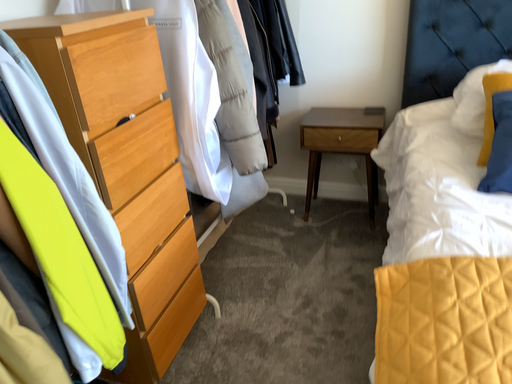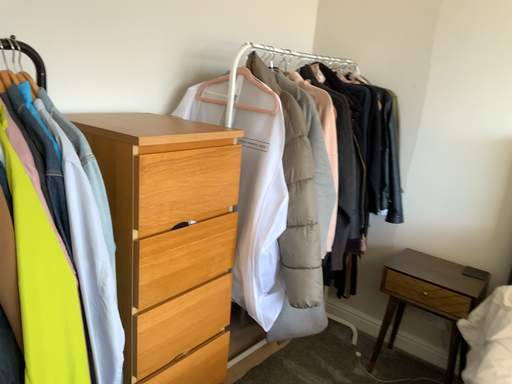
Question: Which way did the camera rotate in the video?

Choices:
 (A) rotated downward
 (B) rotated upward

Answer: (B)